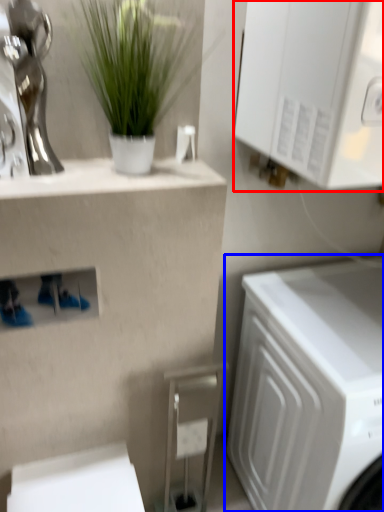
Question: Which object is closer to the camera taking this photo, cabinetry (highlighted by a red box) or washing machine (highlighted by a blue box)?

Choices:
 (A) cabinetry
 (B) washing machine

Answer: (A)